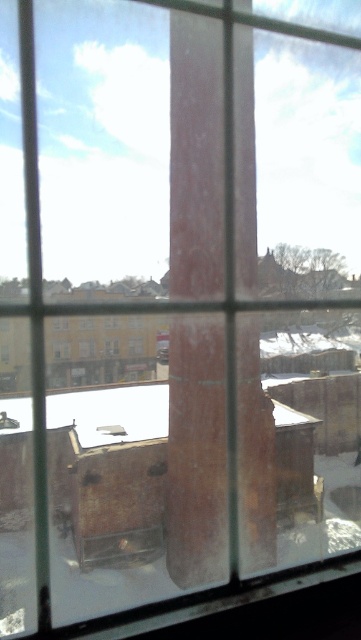
Question: Which point is closer to the camera?

Choices:
 (A) (261, 531)
 (B) (84, 348)

Answer: (A)

Question: Can you confirm if brown wood pillar at center is thinner than yellowish glass window at center?

Choices:
 (A) no
 (B) yes

Answer: (A)

Question: Which object appears closest to the camera in this image?

Choices:
 (A) brown wood pillar at center
 (B) yellowish glass window at center

Answer: (A)

Question: Is brown wood pillar at center to the left of yellowish glass window at center from the viewer's perspective?

Choices:
 (A) no
 (B) yes

Answer: (A)

Question: Can you confirm if brown wood pillar at center is positioned to the right of yellowish glass window at center?

Choices:
 (A) no
 (B) yes

Answer: (B)